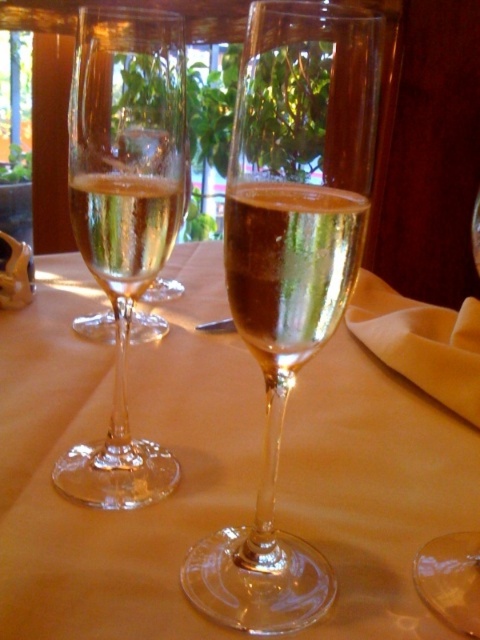
Does beige satin napkin at lower right have a greater height compared to transparent glass at center?

No.

Is beige satin napkin at lower right bigger than transparent glass at center?

Indeed, beige satin napkin at lower right has a larger size compared to transparent glass at center.

Where is `beige satin napkin at lower right`? The image size is (480, 640). beige satin napkin at lower right is located at coordinates (420, 340).

The width and height of the screenshot is (480, 640). I want to click on beige satin napkin at lower right, so click(420, 340).

Between clear glass wine glass at left and transparent glass at center, which one appears on the left side from the viewer's perspective?

clear glass wine glass at left is more to the left.

Does clear glass wine glass at left have a greater width compared to transparent glass at center?

Indeed, clear glass wine glass at left has a greater width compared to transparent glass at center.

Between point (101, 477) and point (441, 605), which one is positioned in front?

Point (441, 605) is more forward.

Find the location of `clear glass wine glass at left`. clear glass wine glass at left is located at coordinates (123, 218).

Is clear glass wine glass at center to the right of transparent glass at center from the viewer's perspective?

No, clear glass wine glass at center is not to the right of transparent glass at center.

Does point (334, 225) lie behind point (427, 556)?

No.

Where is `clear glass wine glass at center`? clear glass wine glass at center is located at coordinates (289, 269).